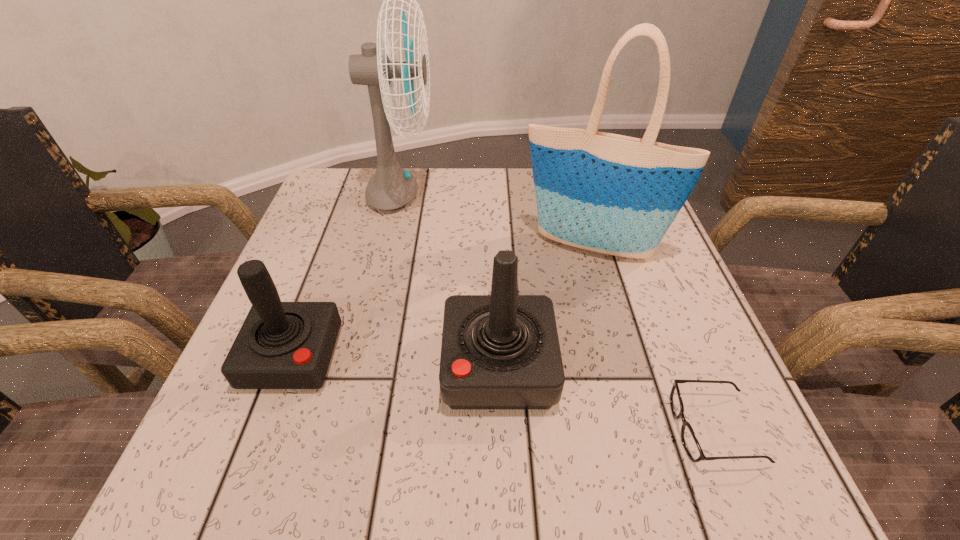
This screenshot has width=960, height=540. In the image, there is a desktop. What are the coordinates of `vacant area at the near right corner` in the screenshot? It's located at (762, 461).

You are a GUI agent. You are given a task and a screenshot of the screen. Output one action in this format:
    pyautogui.click(x=<x>, y=<y>)
    Task: Click on the empty space between the tote bag and the fan
    This screenshot has width=960, height=540.
    Given the screenshot: What is the action you would take?
    pyautogui.click(x=495, y=221)

Locate an element on the screen. Image resolution: width=960 pixels, height=540 pixels. vacant area that lies between the third tallest object and the fan is located at coordinates (450, 281).

Identify the location of vacant area that lies between the fan and the taller joystick. The image size is (960, 540). (450, 281).

Where is `free space between the fan and the spectacles`? free space between the fan and the spectacles is located at coordinates (558, 313).

Where is `empty space between the taller joystick and the shortest object`? This screenshot has height=540, width=960. empty space between the taller joystick and the shortest object is located at coordinates (607, 397).

Find the location of a particular element. This screenshot has width=960, height=540. empty location between the fan and the right joystick is located at coordinates (450, 281).

Where is `free space that is in between the fan and the tote bag`? The height and width of the screenshot is (540, 960). free space that is in between the fan and the tote bag is located at coordinates (495, 221).

Find the location of a particular element. free area in between the spectacles and the fan is located at coordinates (558, 313).

Identify the location of empty space between the fan and the spectacles. (558, 313).